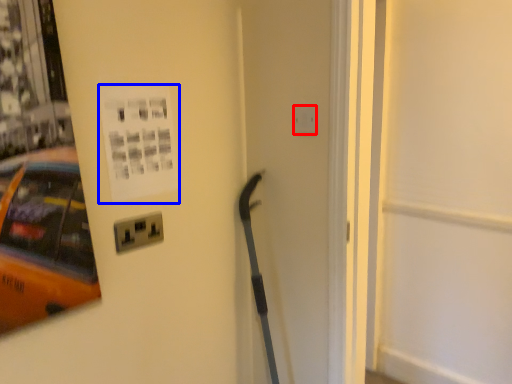
Question: Which object is closer to the camera taking this photo, electric outlet (highlighted by a red box) or poster page (highlighted by a blue box)?

Choices:
 (A) electric outlet
 (B) poster page

Answer: (B)